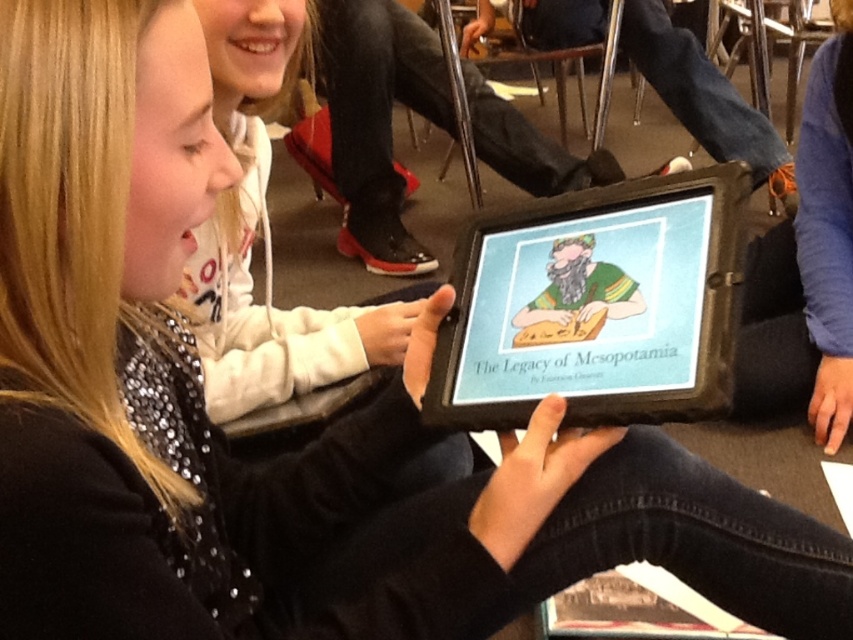
Question: Is the position of black matte tablet at center less distant than that of matte black tablet at center?

Choices:
 (A) no
 (B) yes

Answer: (B)

Question: Can you confirm if black matte tablet at center is positioned to the left of matte black tablet at center?

Choices:
 (A) yes
 (B) no

Answer: (B)

Question: Among these points, which one is farthest from the camera?

Choices:
 (A) (271, 314)
 (B) (515, 417)

Answer: (A)

Question: Is black matte tablet at center in front of matte black tablet at center?

Choices:
 (A) no
 (B) yes

Answer: (B)